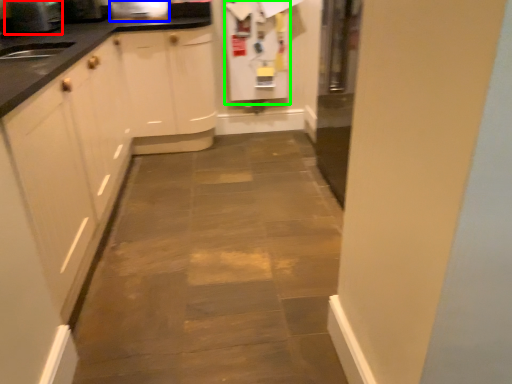
Question: Which is nearer to the appliance (highlighted by a red box)? appliance (highlighted by a blue box) or appliance (highlighted by a green box).

Choices:
 (A) appliance
 (B) appliance

Answer: (A)